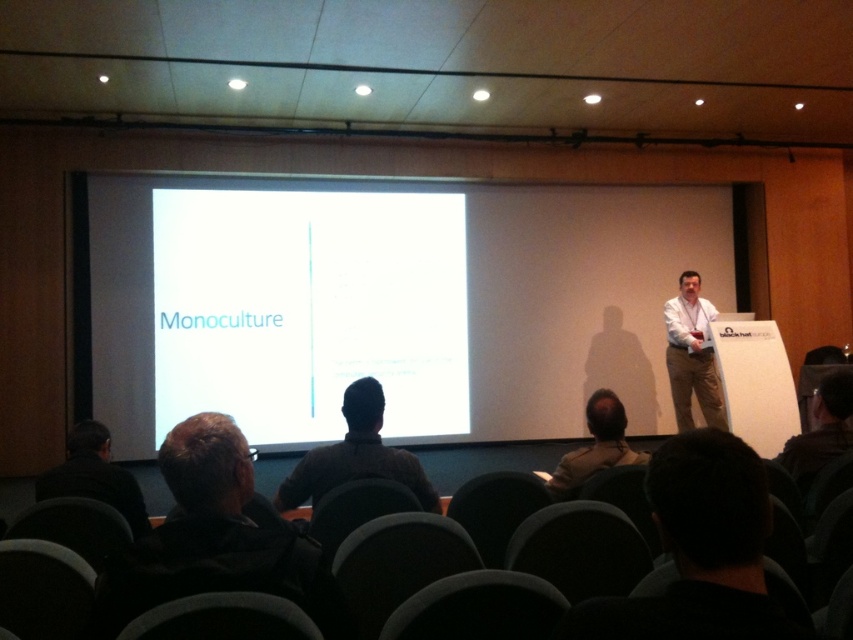
Can you confirm if white matte projection screen at center is positioned to the right of dark gray jacket at lower left?

In fact, white matte projection screen at center is to the left of dark gray jacket at lower left.

Is point (524, 416) farther from camera compared to point (248, 490)?

Yes, it is.

Which is behind, point (672, 216) or point (247, 445)?

Positioned behind is point (672, 216).

Locate an element on the screen. The width and height of the screenshot is (853, 640). white matte projection screen at center is located at coordinates (387, 305).

Can you confirm if khaki cotton pants at right is shorter than dark gray shirt at lower left?

No.

The height and width of the screenshot is (640, 853). Identify the location of khaki cotton pants at right. (691, 355).

Image resolution: width=853 pixels, height=640 pixels. What do you see at coordinates (691, 355) in the screenshot?
I see `khaki cotton pants at right` at bounding box center [691, 355].

In order to click on khaki cotton pants at right in this screenshot , I will do `click(691, 355)`.

What are the coordinates of `white matte projection screen at center` in the screenshot? It's located at (387, 305).

Can you confirm if white matte projection screen at center is bigger than khaki cotton pants at right?

Incorrect, white matte projection screen at center is not larger than khaki cotton pants at right.

Does point (688, 200) come farther from viewer compared to point (668, 342)?

Yes, point (688, 200) is behind point (668, 342).

Locate an element on the screen. The image size is (853, 640). white matte projection screen at center is located at coordinates (387, 305).